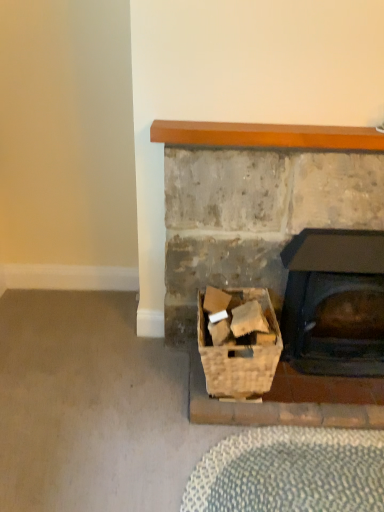
Question: Is woven wood basket at lower center bigger than black matte wood burning stove at center right?

Choices:
 (A) no
 (B) yes

Answer: (A)

Question: Would you consider woven wood basket at lower center to be distant from black matte wood burning stove at center right?

Choices:
 (A) yes
 (B) no

Answer: (B)

Question: Is woven wood basket at lower center wider than black matte wood burning stove at center right?

Choices:
 (A) no
 (B) yes

Answer: (B)

Question: From the image's perspective, is woven wood basket at lower center located beneath black matte wood burning stove at center right?

Choices:
 (A) no
 (B) yes

Answer: (B)

Question: Could you tell me if woven wood basket at lower center is turned towards black matte wood burning stove at center right?

Choices:
 (A) yes
 (B) no

Answer: (B)

Question: Considering the relative positions of woven wood basket at lower center and black matte wood burning stove at center right in the image provided, is woven wood basket at lower center in front of black matte wood burning stove at center right?

Choices:
 (A) no
 (B) yes

Answer: (B)

Question: From a real-world perspective, does woven wood basket at lower center sit lower than wooden mantel at upper center?

Choices:
 (A) no
 (B) yes

Answer: (B)

Question: From the image's perspective, is woven wood basket at lower center located above wooden mantel at upper center?

Choices:
 (A) yes
 (B) no

Answer: (B)

Question: Is the position of woven wood basket at lower center less distant than that of wooden mantel at upper center?

Choices:
 (A) no
 (B) yes

Answer: (B)

Question: Is woven wood basket at lower center at the left side of wooden mantel at upper center?

Choices:
 (A) no
 (B) yes

Answer: (B)

Question: Can you confirm if woven wood basket at lower center is positioned to the right of wooden mantel at upper center?

Choices:
 (A) yes
 (B) no

Answer: (B)

Question: Is there a large distance between woven wood basket at lower center and wooden mantel at upper center?

Choices:
 (A) yes
 (B) no

Answer: (B)

Question: Is black matte wood burning stove at center right to the right of woven wood basket at lower center from the viewer's perspective?

Choices:
 (A) no
 (B) yes

Answer: (B)